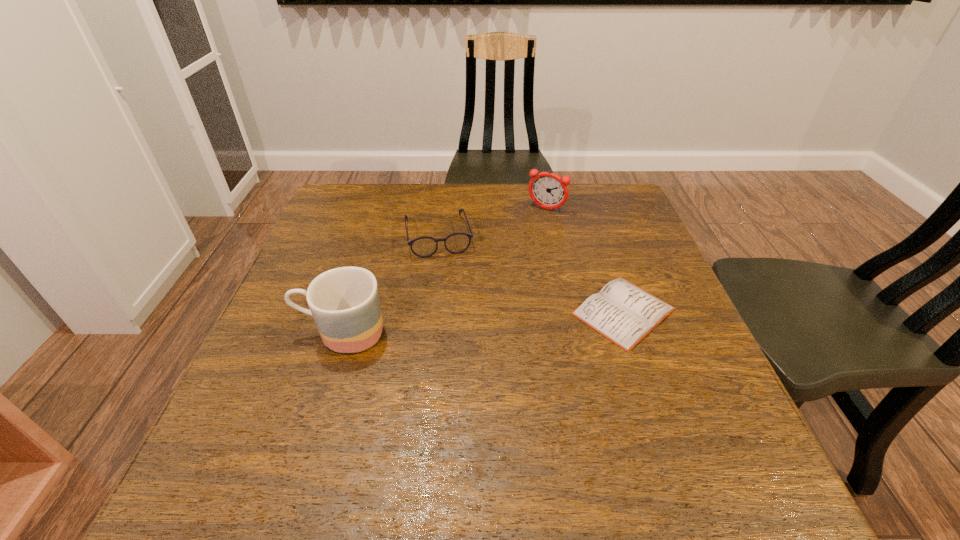
At what (x,y) coordinates should I click in order to perform the action: click on free space located on the front-facing side of the second shortest object. Please return your answer as a coordinate pair (x, y). The image size is (960, 540). Looking at the image, I should click on (450, 291).

Locate an element on the screen. The width and height of the screenshot is (960, 540). vacant space situated on the front-facing side of the second shortest object is located at coordinates (455, 313).

This screenshot has width=960, height=540. Find the location of `vacant space located on the front-facing side of the second shortest object`. vacant space located on the front-facing side of the second shortest object is located at coordinates (454, 309).

At what (x,y) coordinates should I click in order to perform the action: click on alarm clock that is positioned at the far edge. Please return your answer as a coordinate pair (x, y). The image size is (960, 540). Looking at the image, I should click on (548, 190).

The height and width of the screenshot is (540, 960). What are the coordinates of `spectacles that is positioned at the far edge` in the screenshot? It's located at (456, 243).

Locate an element on the screen. The image size is (960, 540). object that is at the left edge is located at coordinates (344, 302).

Find the location of a particular element. object at the right edge is located at coordinates (622, 312).

In the image, there is a desktop. Identify the location of vacant space at the far edge. This screenshot has width=960, height=540. (422, 223).

Find the location of a particular element. This screenshot has height=540, width=960. vacant space at the near edge of the desktop is located at coordinates (323, 408).

At what (x,y) coordinates should I click in order to perform the action: click on free space at the left edge of the desktop. Please return your answer as a coordinate pair (x, y). The height and width of the screenshot is (540, 960). Looking at the image, I should click on (269, 374).